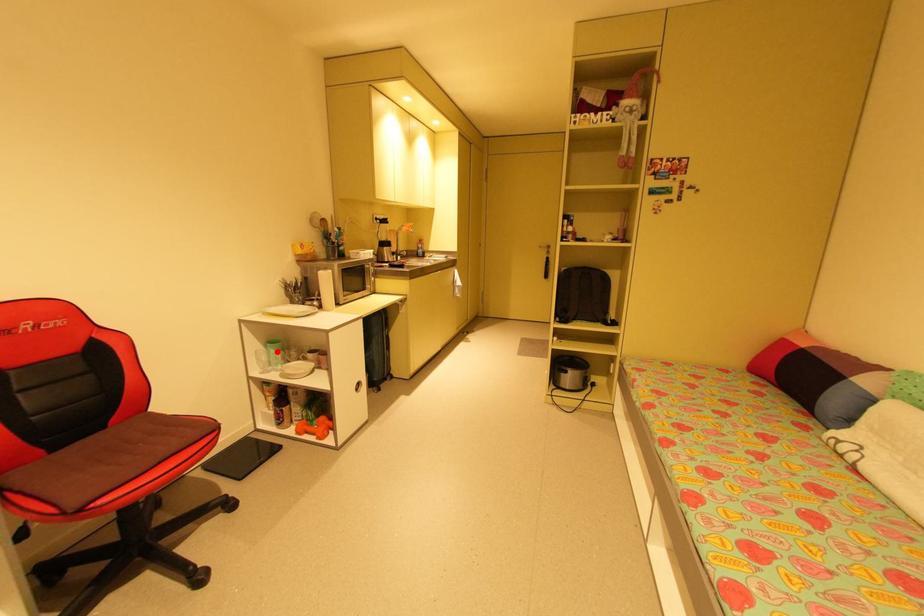
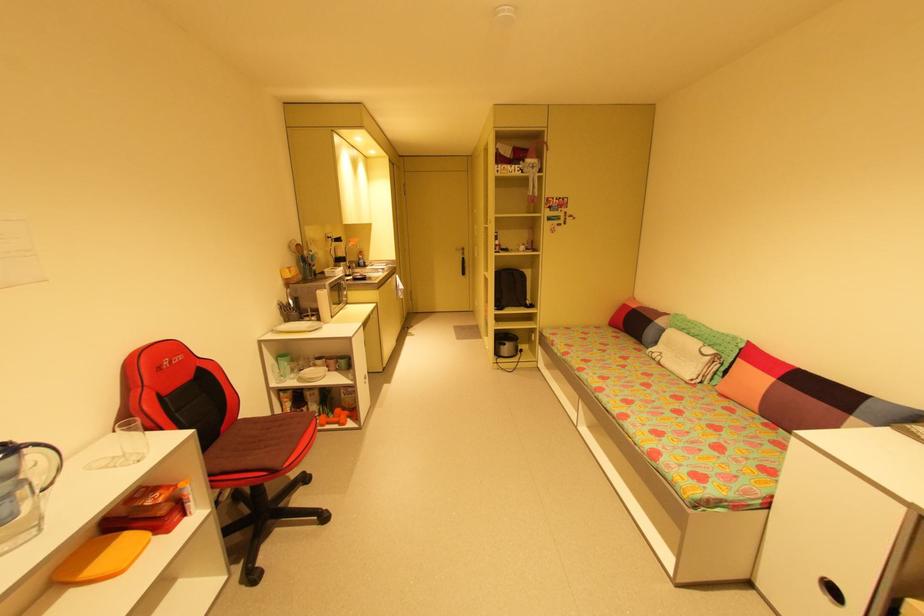
Find the pixel in the second image that matches the highlighted location in the first image.

(290, 363)